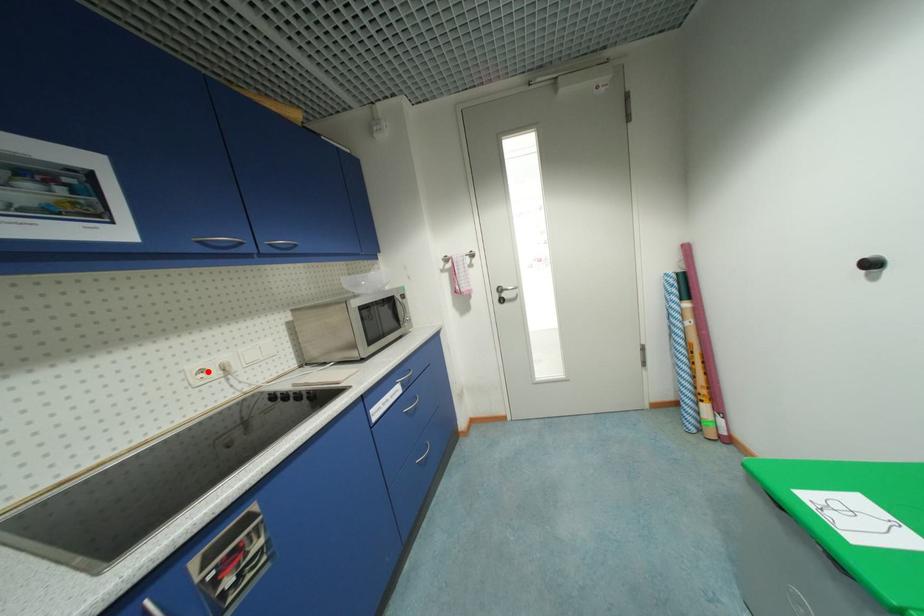
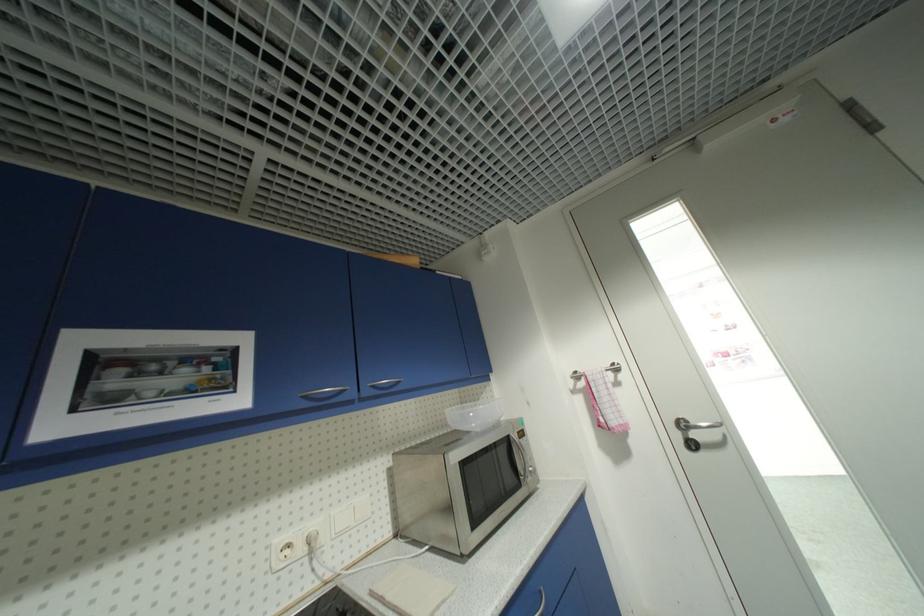
The point at the highlighted location is marked in the first image. Where is the corresponding point in the second image?

(294, 546)